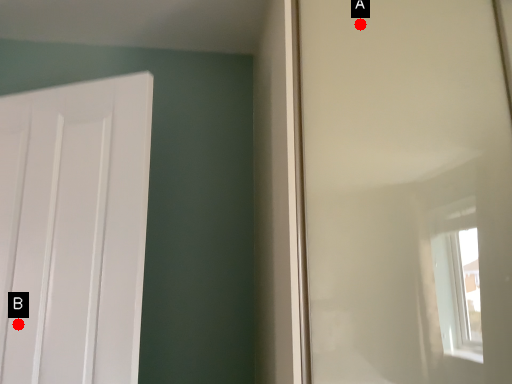
Question: Two points are circled on the image, labeled by A and B beside each circle. Which point is closer to the camera taking this photo?

Choices:
 (A) A is closer
 (B) B is closer

Answer: (A)